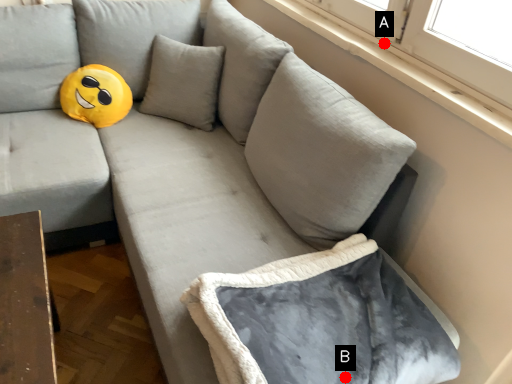
Question: Two points are circled on the image, labeled by A and B beside each circle. Which of the following is the closest to the observer?

Choices:
 (A) A is closer
 (B) B is closer

Answer: (B)